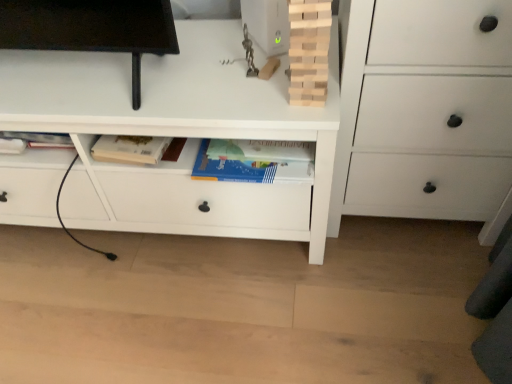
Question: Considering the positions of natural wood tower at upper center and white matte chest of drawers at center, the first chest of drawers when ordered from left to right, in the image, is natural wood tower at upper center wider or thinner than white matte chest of drawers at center, the first chest of drawers when ordered from left to right,?

Choices:
 (A) wide
 (B) thin

Answer: (B)

Question: From the image's perspective, is natural wood tower at upper center positioned above or below white matte chest of drawers at center, the second chest of drawers when ordered from right to left?

Choices:
 (A) above
 (B) below

Answer: (A)

Question: Considering the real-world distances, which object is closest to the white matte chest of drawers at center, the second chest of drawers when ordered from right to left?

Choices:
 (A) natural wood tower at upper center
 (B) white matte chest of drawers at right, which ranks as the 1th chest of drawers in right-to-left order

Answer: (B)

Question: Which of these objects is positioned farthest from the white matte chest of drawers at center, the first chest of drawers when ordered from left to right?

Choices:
 (A) natural wood tower at upper center
 (B) white matte chest of drawers at right, the second chest of drawers from the left

Answer: (A)